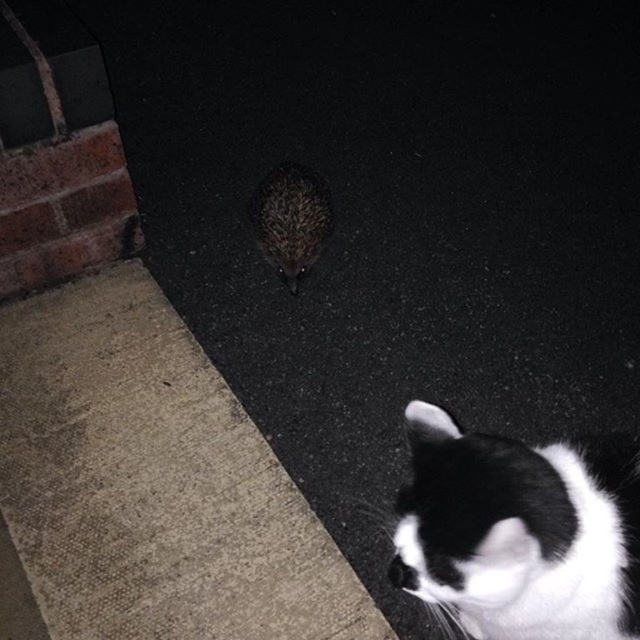
At what (x,y) coordinates should I click in order to perform the action: click on gray concrete pavement at center. Please return your answer as a coordinate pair (x, y). Looking at the image, I should click on (152, 483).

Can you confirm if gray concrete pavement at center is positioned above black and white fur cat at lower right?

Indeed, gray concrete pavement at center is positioned over black and white fur cat at lower right.

The height and width of the screenshot is (640, 640). What do you see at coordinates (152, 483) in the screenshot? I see `gray concrete pavement at center` at bounding box center [152, 483].

Find the location of a particular element. The height and width of the screenshot is (640, 640). gray concrete pavement at center is located at coordinates (152, 483).

Is point (483, 554) farther from camera compared to point (308, 240)?

No.

Is black and white fur cat at lower right taller than spiky brown hedgehog at center?

In fact, black and white fur cat at lower right may be shorter than spiky brown hedgehog at center.

You are a GUI agent. You are given a task and a screenshot of the screen. Output one action in this format:
    pyautogui.click(x=<x>, y=<y>)
    Task: Click on the black and white fur cat at lower right
    This screenshot has width=640, height=640.
    Given the screenshot: What is the action you would take?
    pyautogui.click(x=518, y=531)

Which is in front, point (131, 410) or point (321, 184)?

Point (131, 410)

Is point (33, 307) behind point (304, 253)?

No, it is not.

Between point (205, 385) and point (310, 180), which one is positioned behind?

Positioned behind is point (310, 180).

Identify the location of gray concrete pavement at center. The image size is (640, 640). (152, 483).